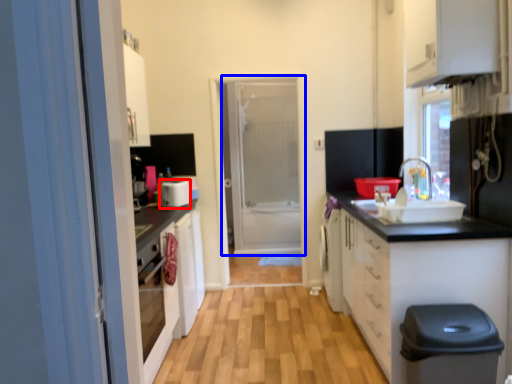
Question: Which object is closer to the camera taking this photo, appliance (highlighted by a red box) or door (highlighted by a blue box)?

Choices:
 (A) appliance
 (B) door

Answer: (A)